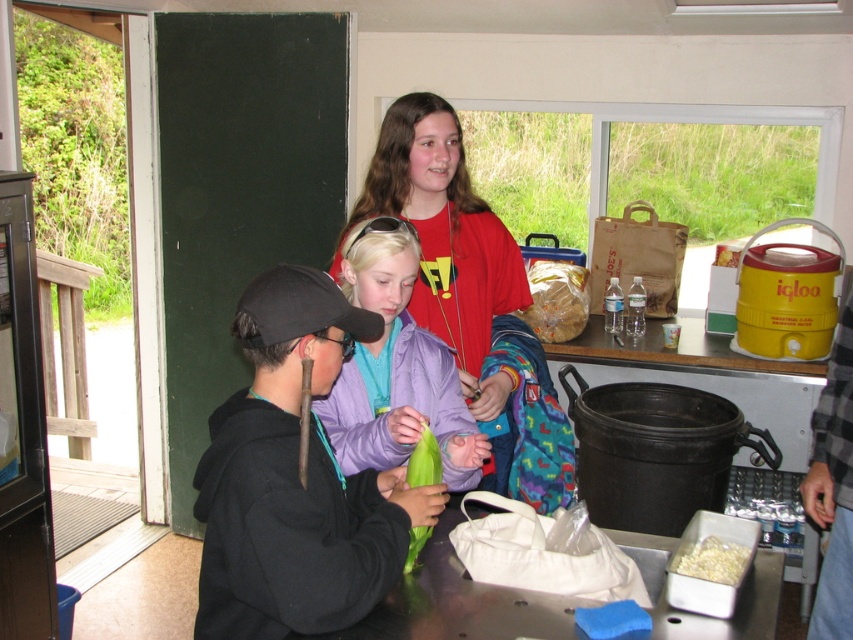
Question: Is matte red shirt at center smaller than white matte container at lower right?

Choices:
 (A) no
 (B) yes

Answer: (A)

Question: Estimate the real-world distances between objects in this image. Which object is closer to the purple fabric jacket at center?

Choices:
 (A) yellow plastic cooler at right
 (B) white matte container at lower right

Answer: (B)

Question: Does white matte container at lower right have a lesser width compared to white crumbly food at lower right?

Choices:
 (A) no
 (B) yes

Answer: (A)

Question: Which point is closer to the camera?

Choices:
 (A) white matte container at lower right
 (B) matte red shirt at center

Answer: (A)

Question: Which of these objects is positioned closest to the white crumbly food at lower right?

Choices:
 (A) yellow plastic cooler at right
 (B) matte red shirt at center
 (C) purple fabric jacket at center
 (D) black matte jacket at center

Answer: (A)

Question: From the image, what is the correct spatial relationship of matte red shirt at center in relation to purple fabric jacket at center?

Choices:
 (A) left
 (B) right

Answer: (B)